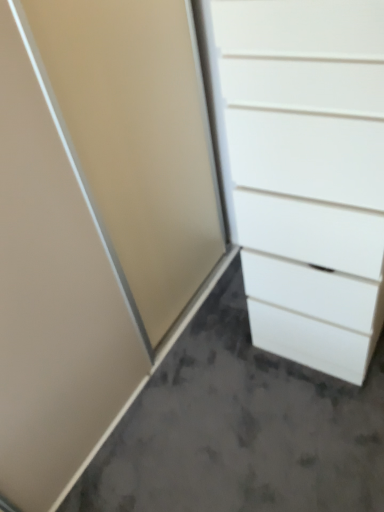
Question: Is white matte concrete at lower right inside the boundaries of white matte chest of drawers at right, or outside?

Choices:
 (A) inside
 (B) outside

Answer: (B)

Question: From the image's perspective, is white matte concrete at lower right located above or below white matte chest of drawers at right?

Choices:
 (A) below
 (B) above

Answer: (A)

Question: Considering the relative positions of white matte concrete at lower right and white matte chest of drawers at right in the image provided, is white matte concrete at lower right to the left or to the right of white matte chest of drawers at right?

Choices:
 (A) left
 (B) right

Answer: (A)

Question: From the image's perspective, is white matte chest of drawers at right located above or below white matte concrete at lower right?

Choices:
 (A) above
 (B) below

Answer: (A)

Question: In the image, is white matte chest of drawers at right positioned in front of or behind white matte concrete at lower right?

Choices:
 (A) behind
 (B) front

Answer: (B)

Question: Does point (268, 31) appear closer or farther from the camera than point (299, 460)?

Choices:
 (A) farther
 (B) closer

Answer: (B)

Question: From their relative heights in the image, would you say white matte chest of drawers at right is taller or shorter than white matte concrete at lower right?

Choices:
 (A) tall
 (B) short

Answer: (A)